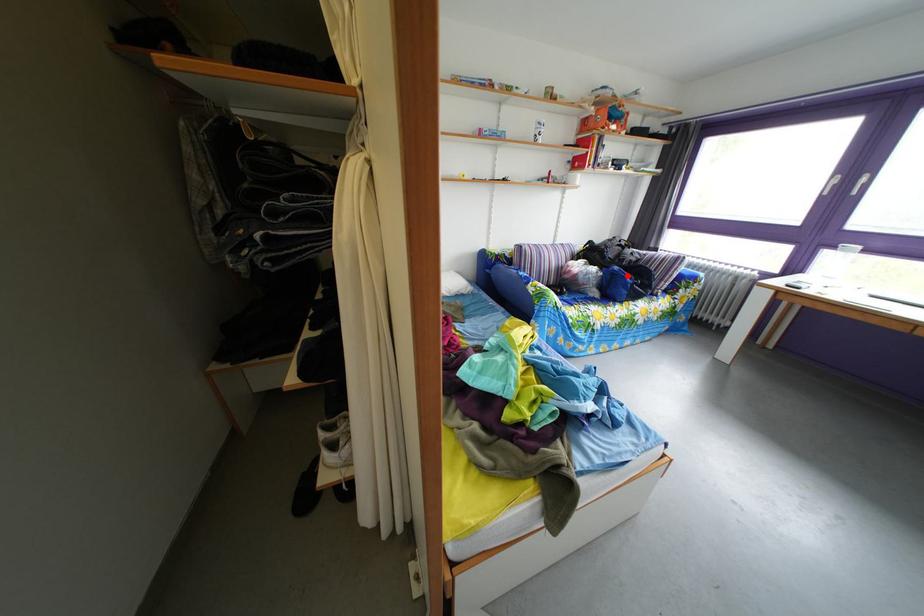
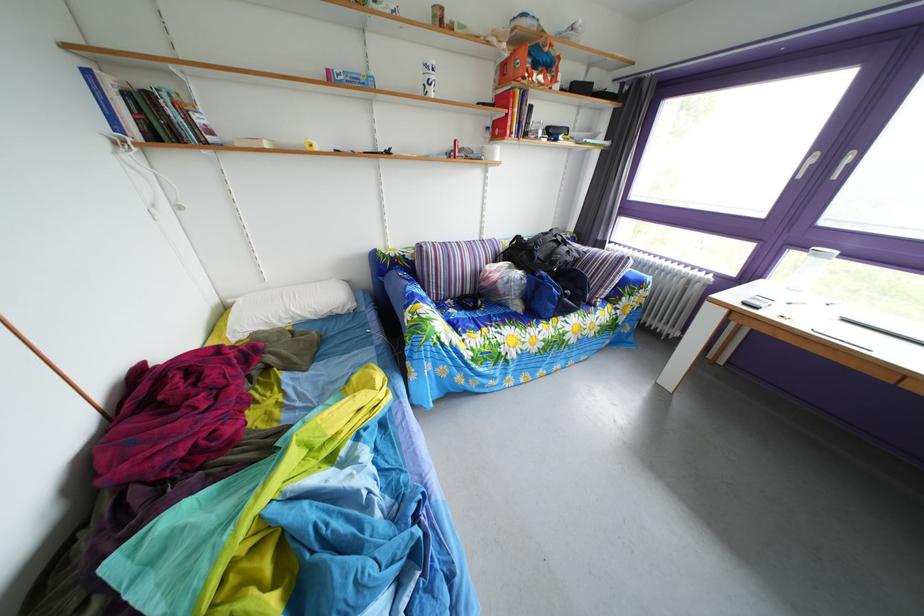
Where in the second image is the point corresponding to the highlighted location from the first image?

(553, 282)